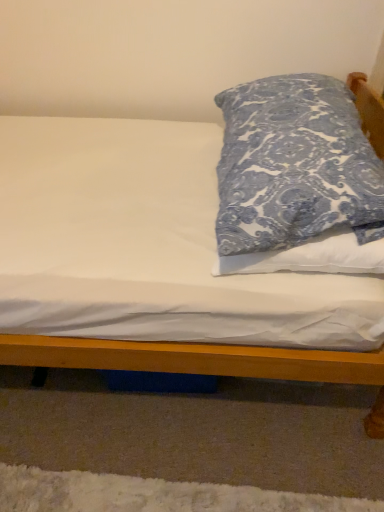
Question: Is white matte bed at center taller or shorter than blue printed fabric pillow at upper right?

Choices:
 (A) tall
 (B) short

Answer: (B)

Question: From the image's perspective, relative to blue printed fabric pillow at upper right, is white matte bed at center above or below?

Choices:
 (A) below
 (B) above

Answer: (A)

Question: In the image, is white matte bed at center positioned in front of or behind blue printed fabric pillow at upper right?

Choices:
 (A) behind
 (B) front

Answer: (A)

Question: Looking at their shapes, would you say blue printed fabric pillow at upper right is wider or thinner than white matte bed at center?

Choices:
 (A) thin
 (B) wide

Answer: (A)

Question: From the image's perspective, is blue printed fabric pillow at upper right above or below white matte bed at center?

Choices:
 (A) below
 (B) above

Answer: (B)

Question: From a real-world perspective, is blue printed fabric pillow at upper right physically located above or below white matte bed at center?

Choices:
 (A) below
 (B) above

Answer: (B)

Question: Does point (238, 167) appear closer or farther from the camera than point (76, 355)?

Choices:
 (A) farther
 (B) closer

Answer: (B)